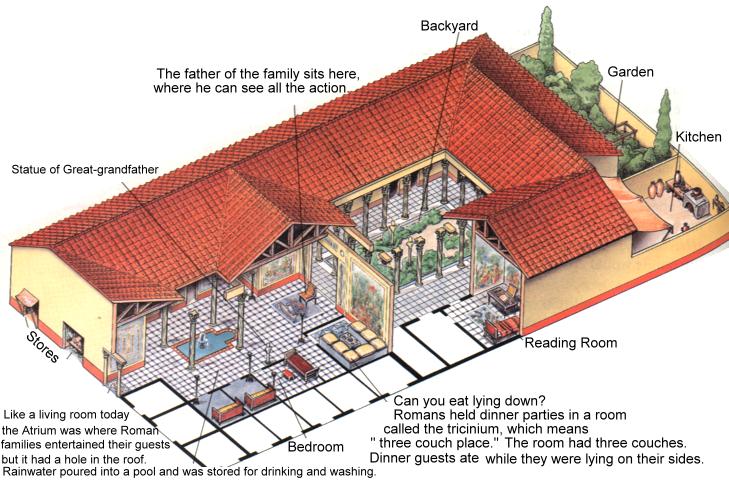
At what (x,y) coordinates should I click in order to perform the action: click on 2 areas with plants. Please return your answer as a coordinate pair (x, y). This screenshot has height=480, width=729. Looking at the image, I should click on (394, 259), (590, 111).